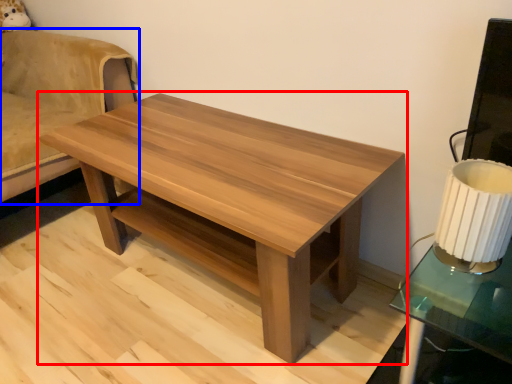
Question: Which point is closer to the camera, coffee table (highlighted by a red box) or swivel chair (highlighted by a blue box)?

Choices:
 (A) coffee table
 (B) swivel chair

Answer: (A)